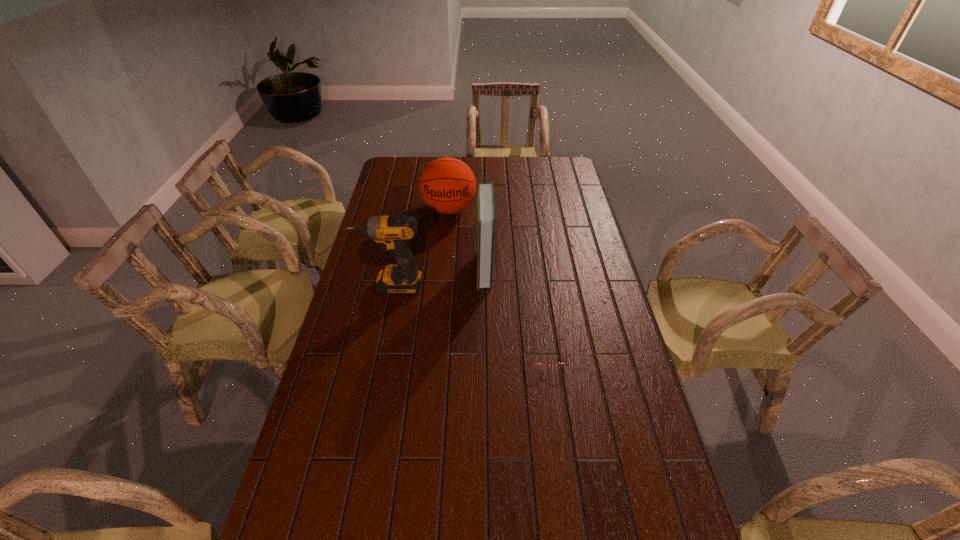
This screenshot has height=540, width=960. What are the coordinates of `the third object from left to right` in the screenshot? It's located at (486, 202).

At what (x,y) coordinates should I click in order to perform the action: click on drill. Please return your answer as a coordinate pair (x, y). The height and width of the screenshot is (540, 960). Looking at the image, I should click on (393, 232).

The image size is (960, 540). In order to click on the second shortest object in this screenshot , I will do `click(447, 185)`.

Where is `basketball`? The height and width of the screenshot is (540, 960). basketball is located at coordinates (447, 185).

Where is `spectacles`? This screenshot has height=540, width=960. spectacles is located at coordinates (534, 365).

Locate an element on the screen. This screenshot has width=960, height=540. the nearest object is located at coordinates (534, 365).

This screenshot has height=540, width=960. Find the location of `vacant space located 0.400m on the cover of the second object from right to left`. vacant space located 0.400m on the cover of the second object from right to left is located at coordinates (370, 269).

The height and width of the screenshot is (540, 960). Identify the location of vacant space located on the cover of the second object from right to left. (440, 269).

Locate an element on the screen. The width and height of the screenshot is (960, 540). vacant space located 0.340m on the cover of the second object from right to left is located at coordinates (386, 269).

I want to click on free space located 0.200m on the side with logo of the basketball, so click(444, 256).